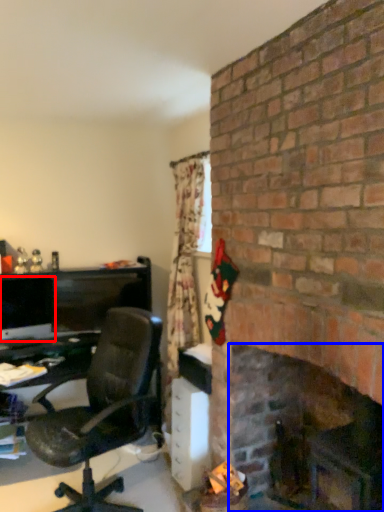
Question: Among these objects, which one is nearest to the camera, computer monitor (highlighted by a red box) or fireplace (highlighted by a blue box)?

Choices:
 (A) computer monitor
 (B) fireplace

Answer: (B)